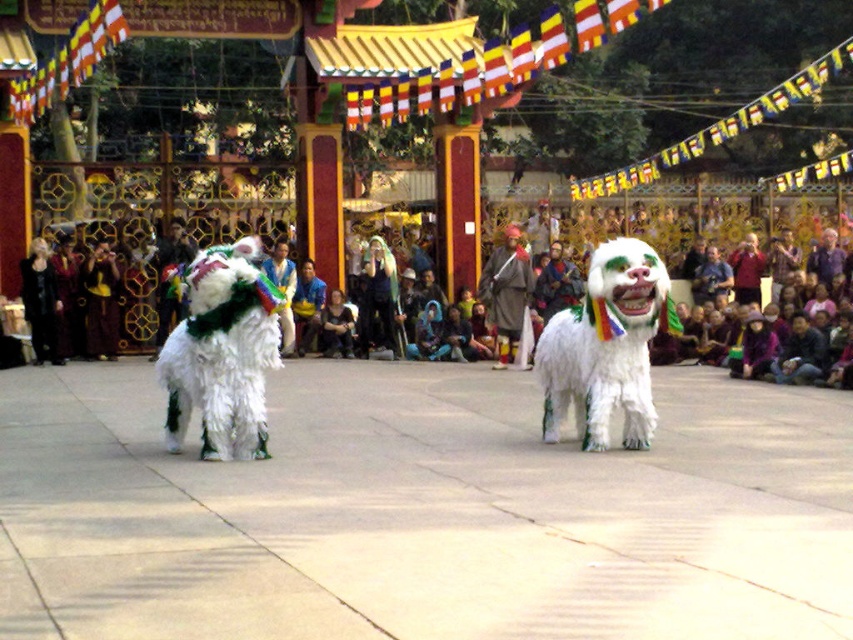
You are a photographer at the event and want to ensure both the black velvet dress at center and the green fuzzy costume at center are clearly visible in your photo. Given their sizes, which one might you need to position closer to the camera to ensure it appears the same size as the other in the final image?

The black velvet dress at center has a smaller size compared to the green fuzzy costume at center, so you should position the black velvet dress at center closer to the camera to make it appear the same size as the green fuzzy costume at center in the photo.

You are a photographer at the festival and want to capture both the matte green costume at center and the dark blue fabric jacket at center in a single frame. Which costume should you focus on to ensure both are visible without zooming in or out?

The matte green costume at center is bigger than the dark blue fabric jacket at center, so focus on the matte green costume at center to ensure both are visible without adjusting the zoom.

You are a photographer positioned at the center of the scene. You want to capture both the matte green costume at center and the dark blue fabric jacket at center in a single shot without moving the camera. Given that your camera has a 2.5 meter focal length, will you be able to include both subjects in the frame?

The distance between the matte green costume at center and the dark blue fabric jacket at center is 3.22 meters. Since the camera has a focal length of 2.5 meters, which is shorter than the distance between the two subjects, the photographer may need to adjust the camera settings or move closer to ensure both are in frame.